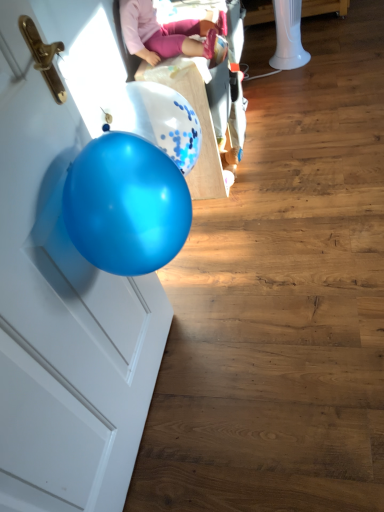
At what (x,y) coordinates should I click in order to perform the action: click on free space that is in between glossy blue balloon at left and white plastic baby carriage at upper center. Please return your answer as a coordinate pair (x, y). Image resolution: width=384 pixels, height=512 pixels. Looking at the image, I should click on (203, 270).